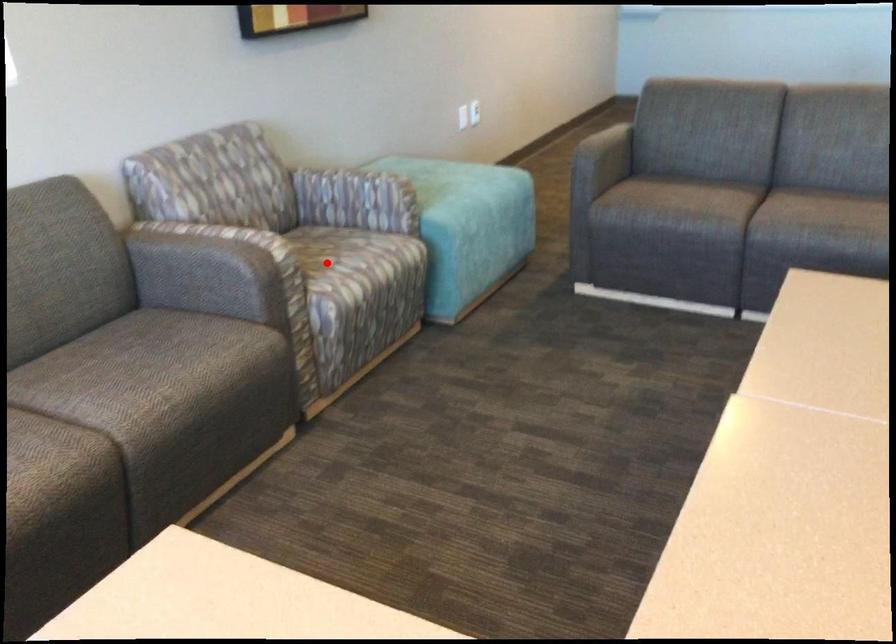
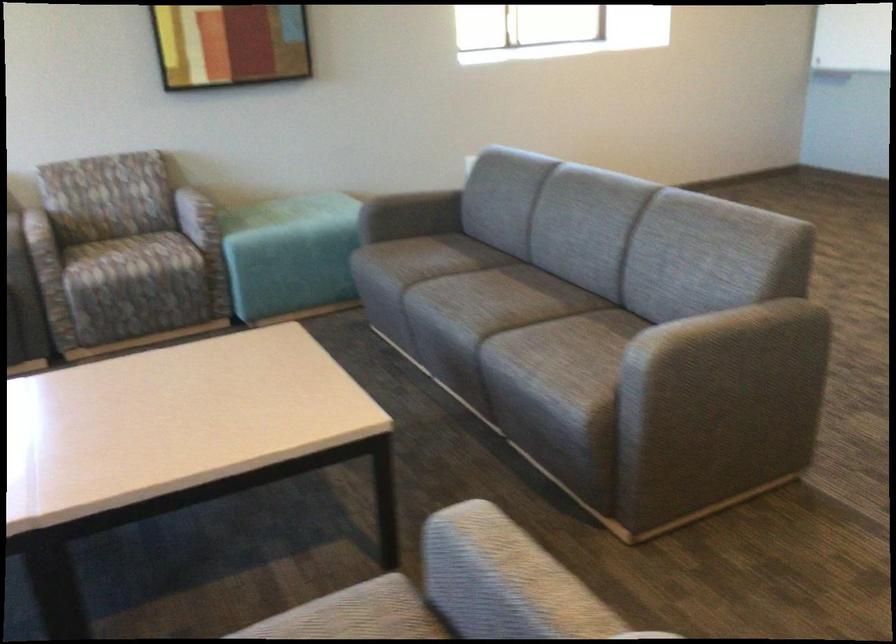
In the second image, find the point that corresponds to the highlighted location in the first image.

(125, 259)